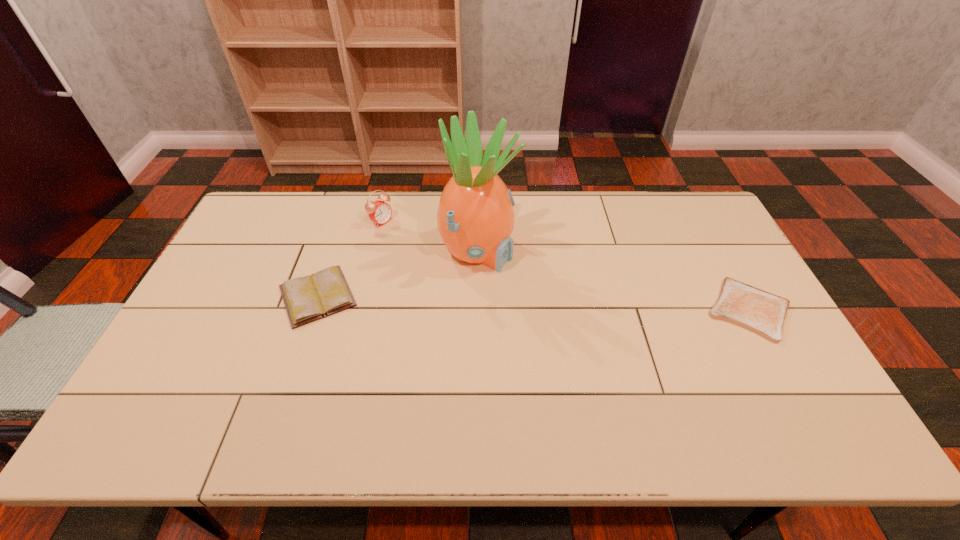
Find the location of `free space at the right edge of the desktop`. free space at the right edge of the desktop is located at coordinates (714, 257).

At what (x,y) coordinates should I click in order to perform the action: click on vacant space at the far left corner of the desktop. Please return your answer as a coordinate pair (x, y). The width and height of the screenshot is (960, 540). Looking at the image, I should click on [x=254, y=206].

Locate an element on the screen. The width and height of the screenshot is (960, 540). empty space that is in between the rightmost object and the second shortest object is located at coordinates (533, 303).

Where is `free space between the alarm clock and the third object from left to right`? This screenshot has width=960, height=540. free space between the alarm clock and the third object from left to right is located at coordinates (429, 236).

Find the location of a particular element. The height and width of the screenshot is (540, 960). free point between the third tallest object and the second tallest object is located at coordinates (349, 259).

Image resolution: width=960 pixels, height=540 pixels. I want to click on vacant space that's between the alarm clock and the rightmost object, so tap(564, 266).

Find the location of a particular element. Image resolution: width=960 pixels, height=540 pixels. unoccupied position between the second shortest object and the pineapple is located at coordinates (397, 273).

At what (x,y) coordinates should I click in order to perform the action: click on free spot between the second shortest object and the third shortest object. Please return your answer as a coordinate pair (x, y). Image resolution: width=960 pixels, height=540 pixels. Looking at the image, I should click on [x=349, y=259].

The height and width of the screenshot is (540, 960). Find the location of `vacant area that lies between the toast and the diary`. vacant area that lies between the toast and the diary is located at coordinates (533, 303).

The width and height of the screenshot is (960, 540). What are the coordinates of `vacant area that lies between the alarm clock and the second object from right to left` in the screenshot? It's located at (429, 236).